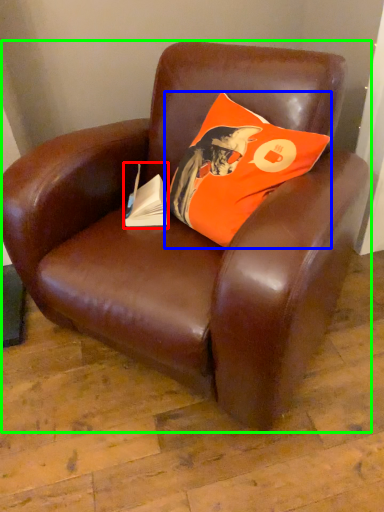
Question: Which object is positioned farthest from paperback book (highlighted by a red box)? Select from pillow (highlighted by a blue box) and chair (highlighted by a green box).

Choices:
 (A) pillow
 (B) chair

Answer: (B)